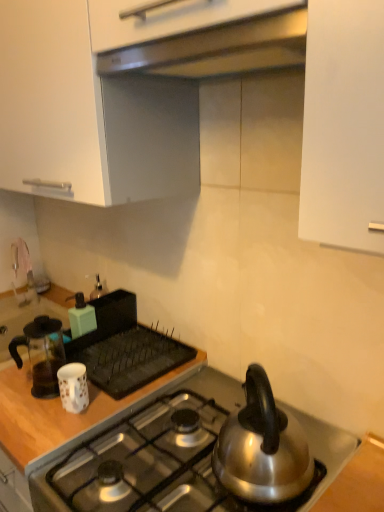
Question: Is transparent glass coffee pot at left, arranged as the second kitchen appliance when viewed from the back, outside of satin silver exhaust hood at upper center?

Choices:
 (A) no
 (B) yes

Answer: (B)

Question: Is transparent glass coffee pot at left, the 2th kitchen appliance in the front-to-back sequence, closer to camera compared to satin silver exhaust hood at upper center?

Choices:
 (A) yes
 (B) no

Answer: (B)

Question: Is transparent glass coffee pot at left, arranged as the second kitchen appliance when viewed from the back, aimed at satin silver exhaust hood at upper center?

Choices:
 (A) yes
 (B) no

Answer: (B)

Question: Considering the relative sizes of transparent glass coffee pot at left, the 2th kitchen appliance in the front-to-back sequence, and satin silver exhaust hood at upper center in the image provided, is transparent glass coffee pot at left, the 2th kitchen appliance in the front-to-back sequence, smaller than satin silver exhaust hood at upper center?

Choices:
 (A) no
 (B) yes

Answer: (B)

Question: From a real-world perspective, does transparent glass coffee pot at left, the 2th kitchen appliance in the front-to-back sequence, sit lower than satin silver exhaust hood at upper center?

Choices:
 (A) yes
 (B) no

Answer: (A)

Question: From their relative heights in the image, would you say woodenmaterial/texturecountertop at left is taller or shorter than white glossy mug at lower left, which ranks as the 1th kitchen appliance in front-to-back order?

Choices:
 (A) tall
 (B) short

Answer: (A)

Question: From the image's perspective, is woodenmaterial/texturecountertop at left located above or below white glossy mug at lower left, which ranks as the 1th kitchen appliance in front-to-back order?

Choices:
 (A) below
 (B) above

Answer: (A)

Question: Is point (18, 439) positioned closer to the camera than point (61, 387)?

Choices:
 (A) closer
 (B) farther

Answer: (A)

Question: In the image, is woodenmaterial/texturecountertop at left on the left side or the right side of white glossy mug at lower left, which ranks as the 1th kitchen appliance in front-to-back order?

Choices:
 (A) right
 (B) left

Answer: (B)

Question: Does point (64, 388) appear closer or farther from the camera than point (21, 358)?

Choices:
 (A) closer
 (B) farther

Answer: (A)

Question: Is white glossy mug at lower left, arranged as the third kitchen appliance when viewed from the back, in front of or behind transparent glass coffee pot at left, the 2th kitchen appliance in the front-to-back sequence, in the image?

Choices:
 (A) behind
 (B) front

Answer: (B)

Question: Is white glossy mug at lower left, arranged as the third kitchen appliance when viewed from the back, bigger or smaller than transparent glass coffee pot at left, the 2th kitchen appliance in the front-to-back sequence?

Choices:
 (A) small
 (B) big

Answer: (A)

Question: From their relative heights in the image, would you say white glossy mug at lower left, which ranks as the 1th kitchen appliance in front-to-back order, is taller or shorter than transparent glass coffee pot at left, the 2th kitchen appliance in the front-to-back sequence?

Choices:
 (A) short
 (B) tall

Answer: (A)

Question: Is silver metallic kettle at right in front of or behind woodenmaterial/texturecountertop at left in the image?

Choices:
 (A) front
 (B) behind

Answer: (A)

Question: Is point (279, 456) positioned closer to the camera than point (26, 395)?

Choices:
 (A) closer
 (B) farther

Answer: (A)